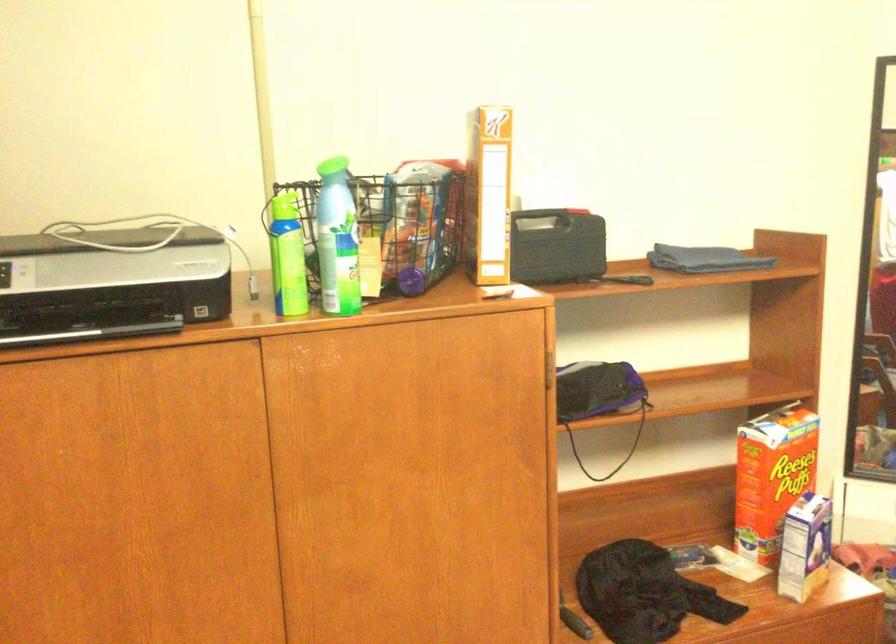
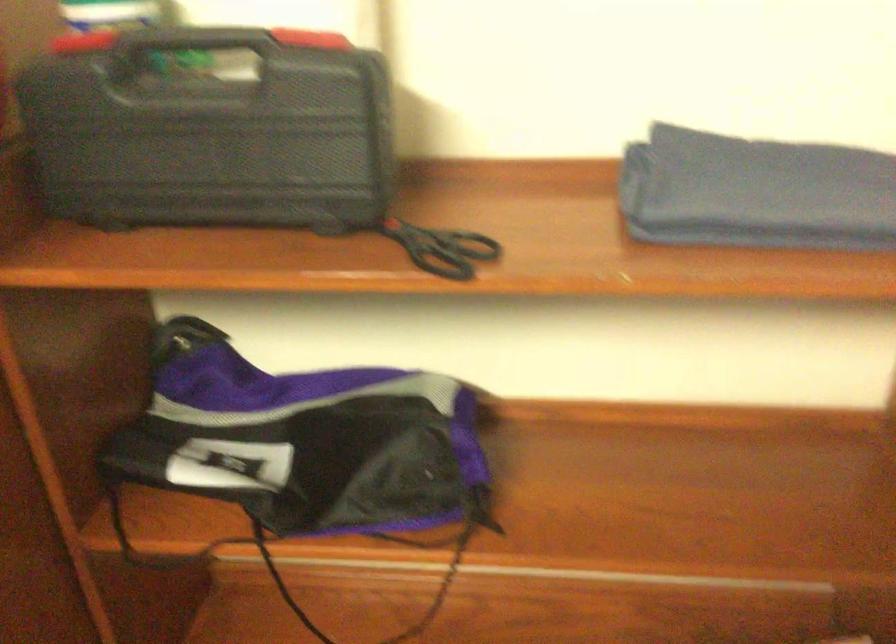
In a continuous first-person perspective shot, in which direction is the camera moving?

The movement direction of the cameraman is right, forward.